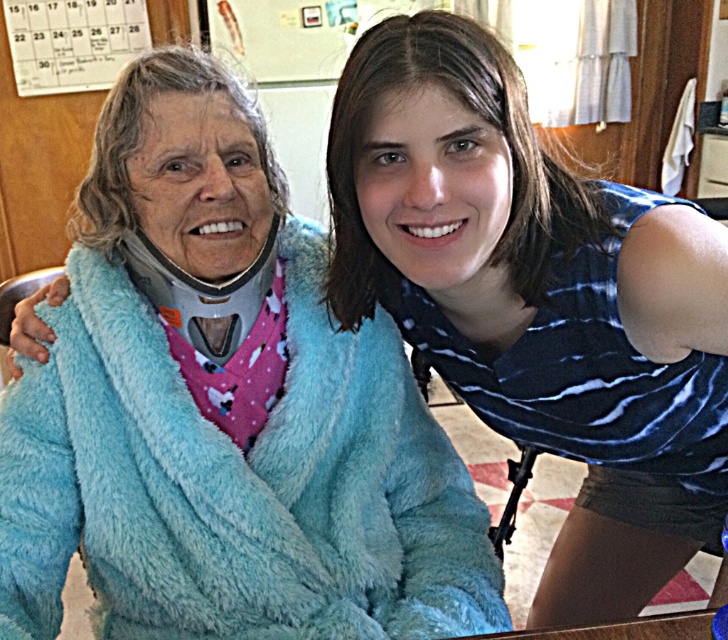
Does point (301, 465) come behind point (644, 388)?

Yes, it is.

Which is in front, point (223, 456) or point (646, 472)?

Point (223, 456) is in front.

Locate an element on the screen. blue fuzzy bathrobe at left is located at coordinates tap(234, 483).